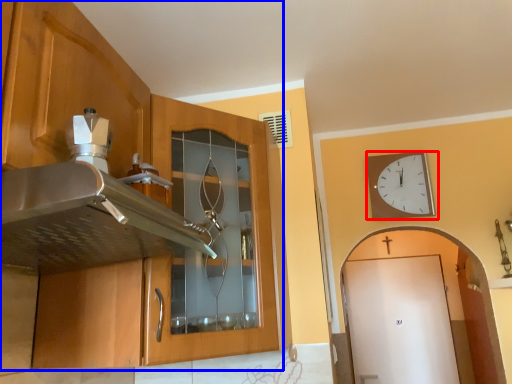
Question: Among these objects, which one is farthest to the camera, wall clock (highlighted by a red box) or cabinetry (highlighted by a blue box)?

Choices:
 (A) wall clock
 (B) cabinetry

Answer: (A)